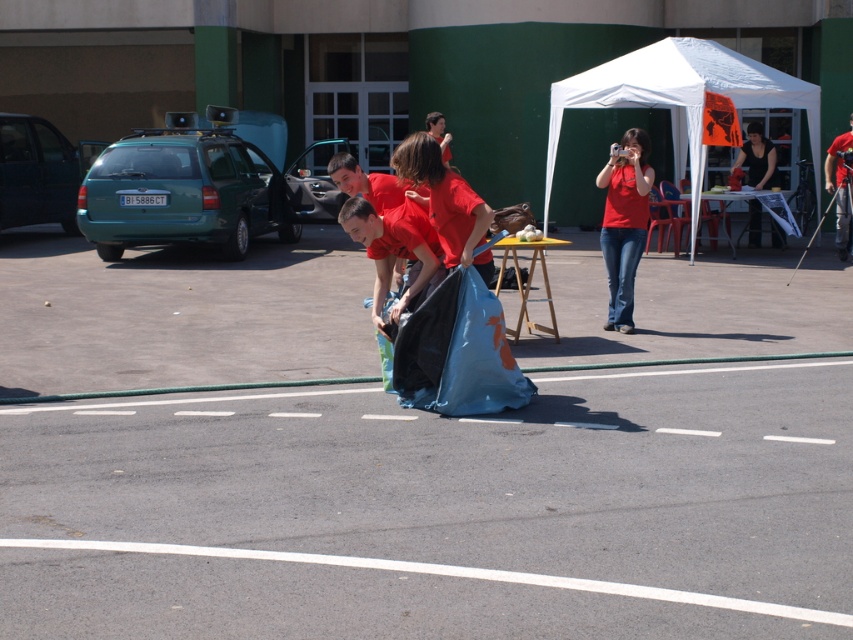
Between matte red shirt at center and smooth red shirt at center, which one has more height?

With more height is matte red shirt at center.

Looking at this image, between matte red shirt at center and smooth red shirt at center, which one has less height?

Standing shorter between the two is smooth red shirt at center.

I want to click on matte red shirt at center, so pyautogui.click(x=445, y=202).

Image resolution: width=853 pixels, height=640 pixels. In order to click on matte red shirt at center in this screenshot , I will do `click(445, 202)`.

Is point (773, 240) positioned after point (442, 124)?

Yes.

Describe the element at coordinates (757, 157) in the screenshot. I see `black fabric shirt at upper right` at that location.

Find the location of a particular element. The width and height of the screenshot is (853, 640). black fabric shirt at upper right is located at coordinates (757, 157).

Does white fabric tent at upper right appear on the right side of smooth red shirt at center?

Indeed, white fabric tent at upper right is positioned on the right side of smooth red shirt at center.

In the scene shown: Does white fabric tent at upper right have a greater height compared to smooth red shirt at center?

Yes, white fabric tent at upper right is taller than smooth red shirt at center.

Find the location of a particular element. The image size is (853, 640). white fabric tent at upper right is located at coordinates (680, 97).

Locate an element on the screen. white fabric tent at upper right is located at coordinates (680, 97).